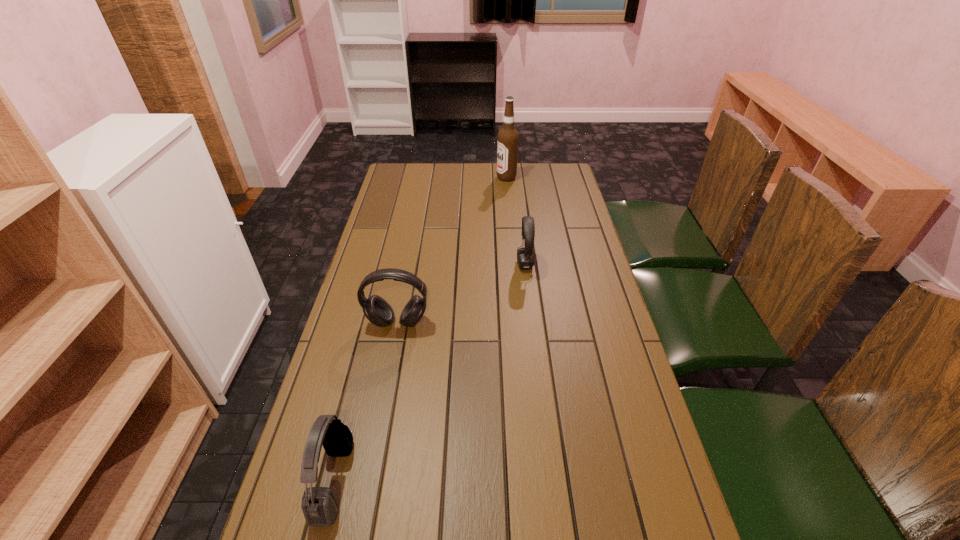
The image size is (960, 540). Find the location of `empty space that is in between the rightmost headset and the second nearest object`. empty space that is in between the rightmost headset and the second nearest object is located at coordinates (462, 294).

The width and height of the screenshot is (960, 540). Identify the location of free space that is in between the nearest object and the farthest object. (420, 329).

Locate an element on the screen. The height and width of the screenshot is (540, 960). blank region between the second farthest headset and the alcohol is located at coordinates (452, 250).

I want to click on free space that is in between the nearest headset and the tallest object, so click(420, 329).

Locate which object is the second closest to the second farthest object. Please provide its 2D coordinates. Your answer should be formatted as a tuple, i.e. [(x, y)], where the tuple contains the x and y coordinates of a point satisfying the conditions above.

[(507, 141)]

Select which object is the second closest to the farthest headset. Please provide its 2D coordinates. Your answer should be formatted as a tuple, i.e. [(x, y)], where the tuple contains the x and y coordinates of a point satisfying the conditions above.

[(507, 141)]

Select which headset appears as the second closest to the nearest headset. Please provide its 2D coordinates. Your answer should be formatted as a tuple, i.e. [(x, y)], where the tuple contains the x and y coordinates of a point satisfying the conditions above.

[(525, 256)]

Where is `headset that stands as the second closest to the third nearest object`? headset that stands as the second closest to the third nearest object is located at coordinates (319, 505).

At what (x,y) coordinates should I click in order to perform the action: click on free location that satisfies the following two spatial constraints: 1. on the earcups of the second farthest headset; 2. on the headband of the nearest headset. Please return your answer as a coordinate pair (x, y). The image size is (960, 540). Looking at the image, I should click on (368, 481).

You are a GUI agent. You are given a task and a screenshot of the screen. Output one action in this format:
    pyautogui.click(x=<x>, y=<y>)
    Task: Click on the free location that satisfies the following two spatial constraints: 1. on the earcups of the second farthest headset; 2. on the headband of the nearest object
    This screenshot has height=540, width=960.
    Given the screenshot: What is the action you would take?
    pyautogui.click(x=368, y=481)